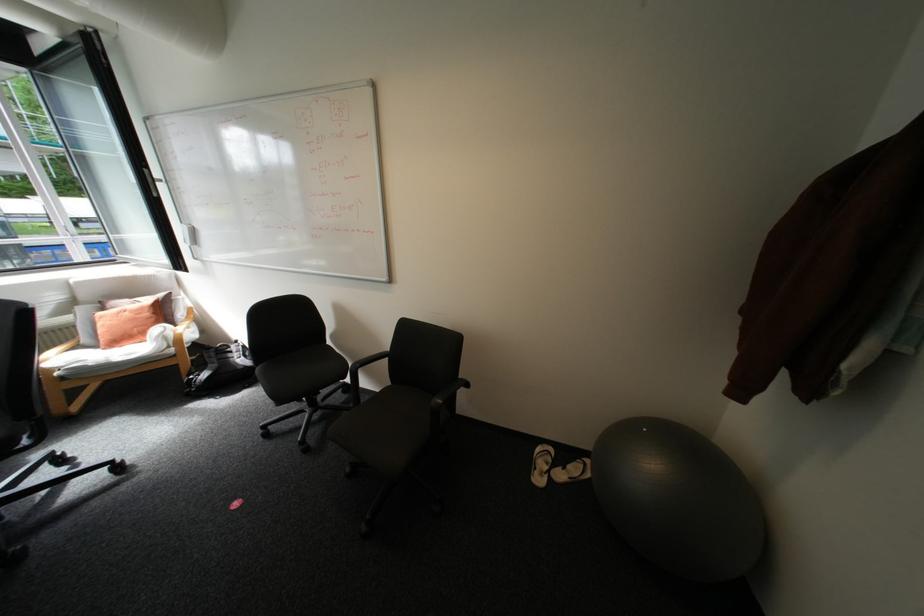
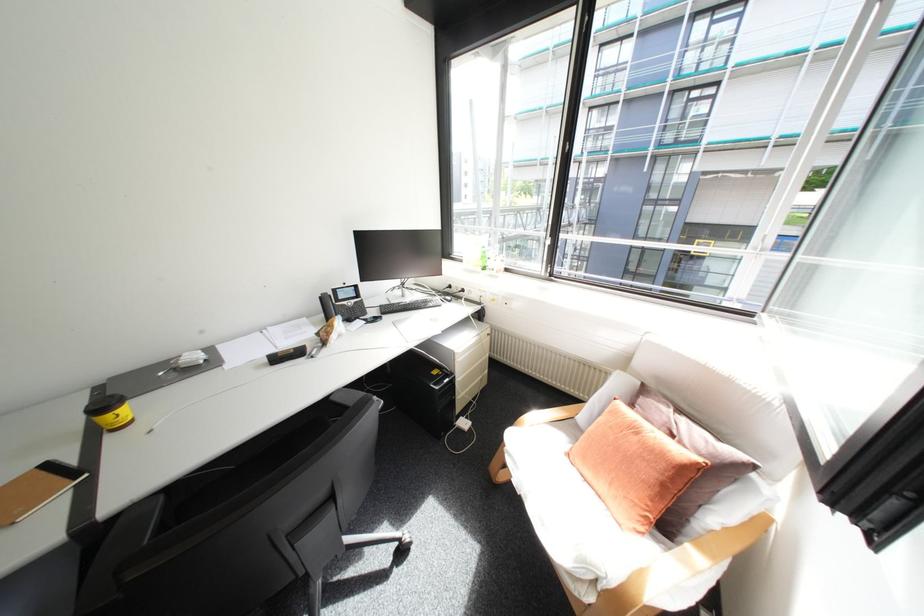
The point at (137,301) is marked in the first image. Where is the corresponding point in the second image?

(677, 410)